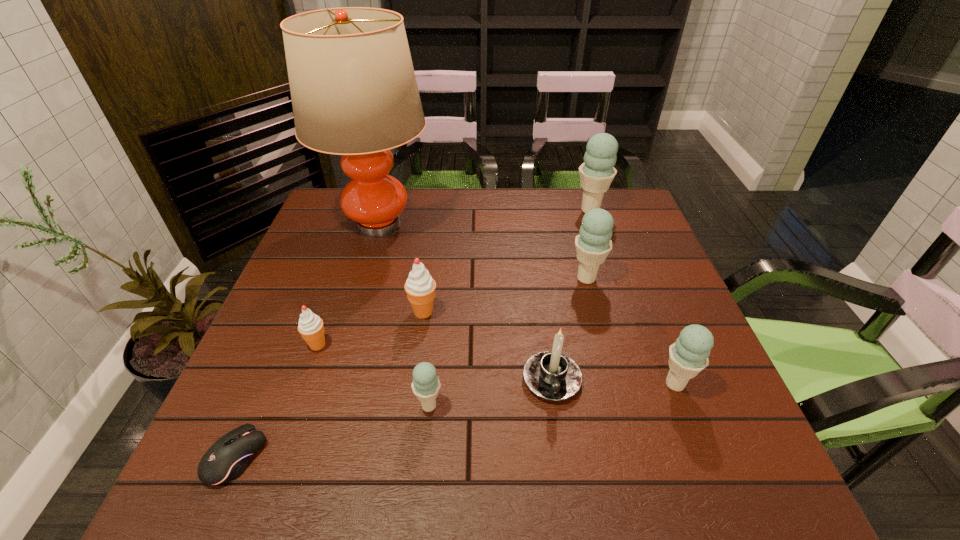
Where is `free spot located with a handle on the side of the candle holder`? free spot located with a handle on the side of the candle holder is located at coordinates (569, 499).

Locate an element on the screen. This screenshot has height=540, width=960. free space located 0.060m on the back of the left red icecream is located at coordinates (327, 316).

What are the coordinates of `vacant space located 0.090m on the left of the smallest blue ice cream` in the screenshot? It's located at (370, 406).

In order to click on free spot located 0.060m on the right of the black computer mouse in this screenshot , I will do `click(296, 457)`.

I want to click on lamp that is at the far edge, so click(x=354, y=93).

Image resolution: width=960 pixels, height=540 pixels. What are the coordinates of `ice cream that is positioned at the far edge` in the screenshot? It's located at (597, 172).

Locate an element on the screen. object that is at the near edge is located at coordinates (229, 456).

Identify the location of lamp that is at the left edge. tap(354, 93).

Locate an element on the screen. The height and width of the screenshot is (540, 960). icecream that is at the left edge is located at coordinates (311, 328).

Identify the location of computer mouse that is at the left edge. (229, 456).